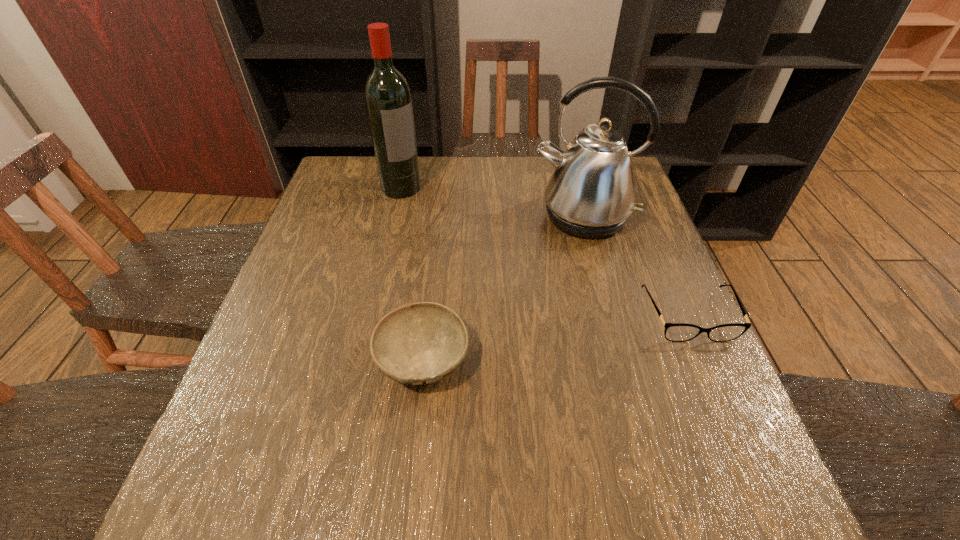
Identify the location of free spot on the desktop that is between the bowl and the shortest object and is positioned on the label of the wine bottle. (542, 340).

What are the coordinates of `free space on the desktop that is between the bowl and the shortest object and is positioned from the spout of the second tallest object` in the screenshot? It's located at (556, 338).